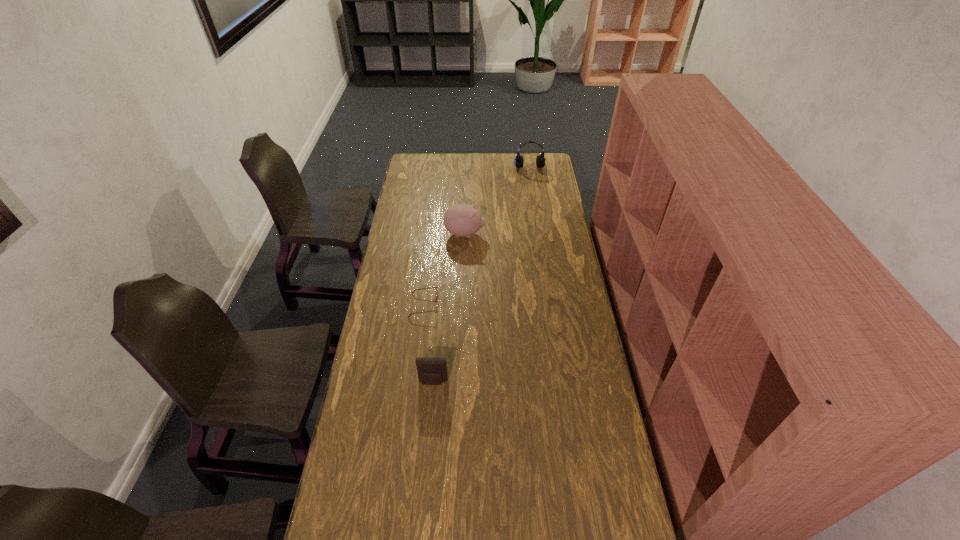
Image resolution: width=960 pixels, height=540 pixels. What are the coordinates of `free space between the second nearest object and the headset` in the screenshot? It's located at (477, 239).

Find the location of `vacant area between the rightmost object and the second nearest object`. vacant area between the rightmost object and the second nearest object is located at coordinates (477, 239).

Locate an element on the screen. The image size is (960, 540). vacant space that is in between the pouch and the farthest object is located at coordinates 482,277.

Where is `free space that is in between the headset and the spectacles`? free space that is in between the headset and the spectacles is located at coordinates (477, 239).

At what (x,y) coordinates should I click in order to perform the action: click on empty location between the rightmost object and the spectacles. Please return your answer as a coordinate pair (x, y). Looking at the image, I should click on (477, 239).

This screenshot has height=540, width=960. I want to click on free spot between the pouch and the spectacles, so click(428, 343).

The width and height of the screenshot is (960, 540). I want to click on vacant space in between the third tallest object and the third nearest object, so click(449, 308).

At what (x,y) coordinates should I click in order to perform the action: click on free point between the rightmost object and the third nearest object. Please return your answer as a coordinate pair (x, y). Looking at the image, I should click on (497, 203).

The width and height of the screenshot is (960, 540). I want to click on free space between the nearest object and the piggy bank, so click(449, 308).

Locate an element on the screen. Image resolution: width=960 pixels, height=540 pixels. vacant area that lies between the third tallest object and the shortest object is located at coordinates (428, 343).